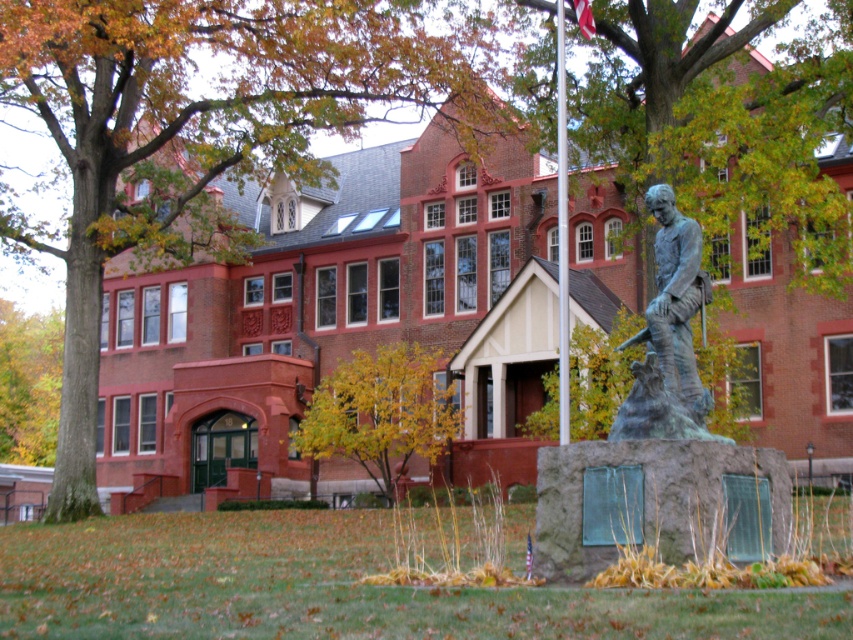
Who is shorter, yellow-green leaves at upper left or red fabric flag at upper center?

red fabric flag at upper center is shorter.

Describe the element at coordinates (28, 385) in the screenshot. I see `yellow-green leaves at upper left` at that location.

Who is more forward, [49,346] or [575,3]?

Point [575,3] is more forward.

At what (x,y) coordinates should I click in order to perform the action: click on yellow-green leaves at upper left. Please return your answer as a coordinate pair (x, y). The width and height of the screenshot is (853, 640). Looking at the image, I should click on (28, 385).

Is green leafy tree at left smaller than red fabric flag at upper center?

No.

Is point (258, 36) in front of point (589, 33)?

No, it is behind (589, 33).

Where is `green leafy tree at left`? green leafy tree at left is located at coordinates (204, 134).

Can you confirm if green leafy tree at left is positioned to the right of yellow leafy tree at center?

Incorrect, green leafy tree at left is not on the right side of yellow leafy tree at center.

Who is more forward, (33, 225) or (358, 440)?

Positioned in front is point (358, 440).

You are a GUI agent. You are given a task and a screenshot of the screen. Output one action in this format:
    pyautogui.click(x=<x>, y=<y>)
    Task: Click on the green leafy tree at left
    The width and height of the screenshot is (853, 640).
    Given the screenshot: What is the action you would take?
    pyautogui.click(x=204, y=134)